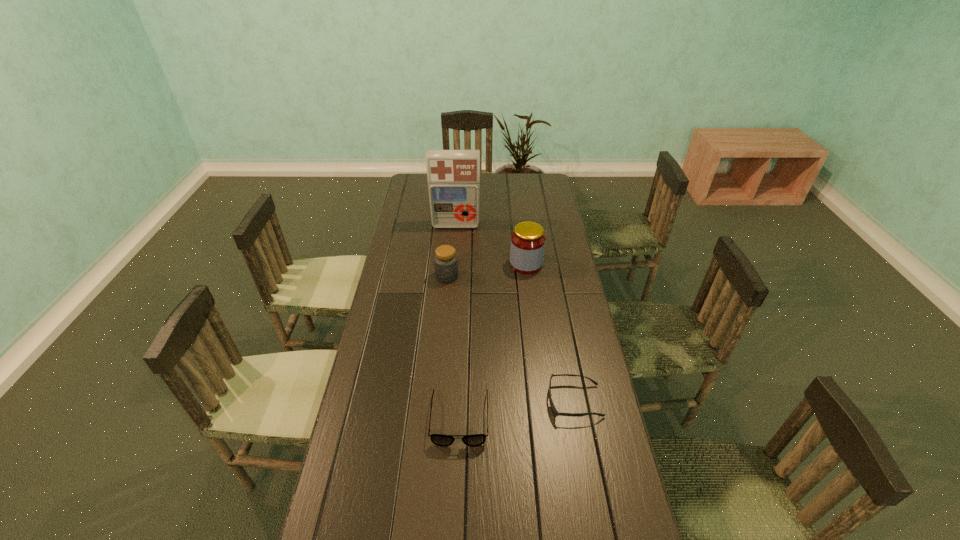
Point out which object is positioned as the second nearest to the shortest object. Please provide its 2D coordinates. Your answer should be formatted as a tuple, i.e. [(x, y)], where the tuple contains the x and y coordinates of a point satisfying the conditions above.

[(527, 247)]

Find the location of a particular element. Image resolution: width=960 pixels, height=540 pixels. vacant space that satisfies the following two spatial constraints: 1. on the front-facing side of the tallest object; 2. on the right side of the right jar is located at coordinates (453, 264).

Where is `free space that satisfies the following two spatial constraints: 1. on the front-facing side of the shortest object; 2. on the front-facing side of the fourth tallest object`? free space that satisfies the following two spatial constraints: 1. on the front-facing side of the shortest object; 2. on the front-facing side of the fourth tallest object is located at coordinates (578, 418).

Where is `vacant region that satisfies the following two spatial constraints: 1. on the front-facing side of the first-aid kit; 2. on the right side of the taller jar`? This screenshot has height=540, width=960. vacant region that satisfies the following two spatial constraints: 1. on the front-facing side of the first-aid kit; 2. on the right side of the taller jar is located at coordinates (453, 264).